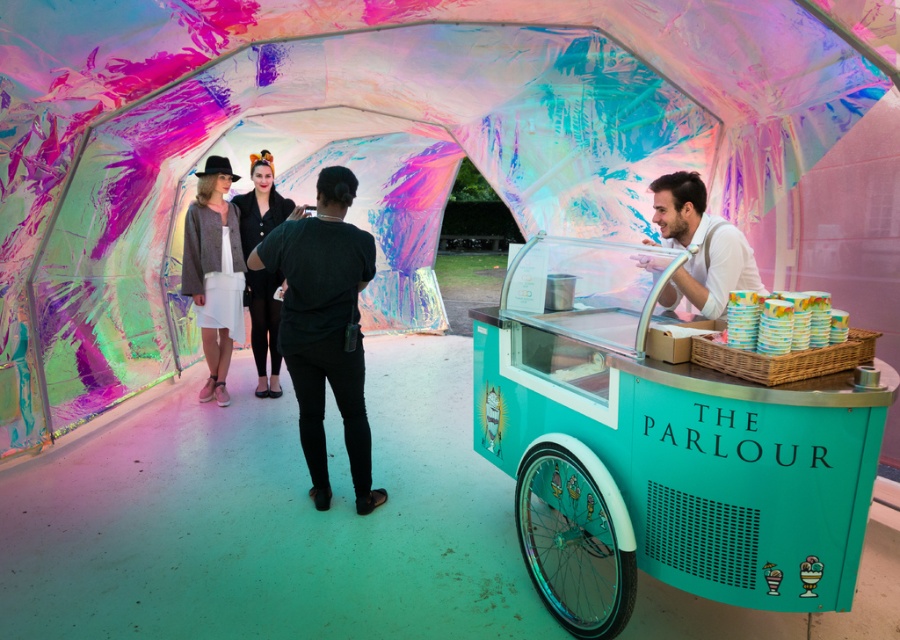
Question: Is the position of black leather jacket at center more distant than that of white glossy cups at right?

Choices:
 (A) no
 (B) yes

Answer: (B)

Question: Considering the real-world distances, which object is closest to the teal matte ice cream cart at center?

Choices:
 (A) white cotton skirt at center
 (B) black matte shirt at center
 (C) black leather jacket at center
 (D) white glossy cups at right

Answer: (D)

Question: Does black matte shirt at center appear on the left side of white glossy cups at right?

Choices:
 (A) yes
 (B) no

Answer: (A)

Question: Which point is farther to the camera?

Choices:
 (A) white shirt at right
 (B) black matte shirt at center

Answer: (B)

Question: Is black matte shirt at center bigger than white shirt at right?

Choices:
 (A) no
 (B) yes

Answer: (B)

Question: Which object is positioned closest to the white glossy cups at right?

Choices:
 (A) teal matte ice cream cart at center
 (B) black leather jacket at center
 (C) black matte shirt at center
 (D) white shirt at right

Answer: (A)